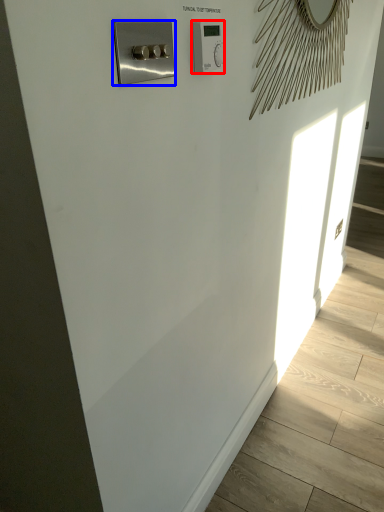
Question: Which point is further to the camera, light switch (highlighted by a red box) or switch (highlighted by a blue box)?

Choices:
 (A) light switch
 (B) switch

Answer: (A)